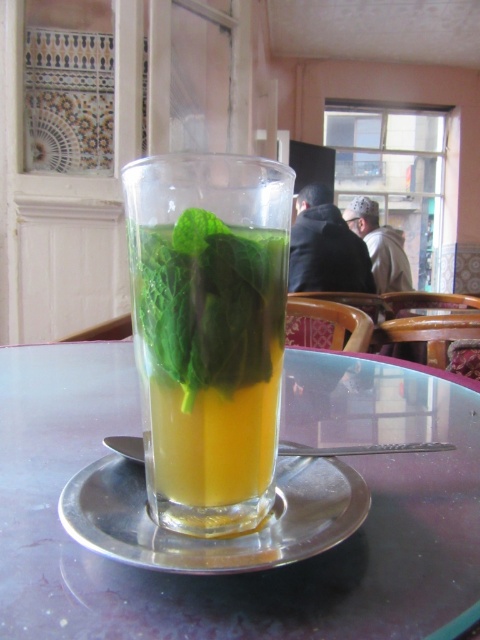
You are a server in a cafe and need to place a small dessert plate between the green leafy mint at center and the silver metallic plate at center on the table. The dessert plate has a diameter of 3 inches. Will there be enough space between them to fit the dessert plate without moving either the mint or the plate?

The distance between the green leafy mint at center and the silver metallic plate at center is 3.29 inches. Since the dessert plate has a diameter of 3 inches, there is enough space to fit it between them without moving either object.

You are at a cafe and want to place your phone on the transparent glass table at center and the silver metallic plate at center. Which surface will reflect your phone more clearly?

The transparent glass table at center will reflect the phone more clearly than the silver metallic plate at center because glass surfaces typically provide clearer reflections compared to metallic ones.